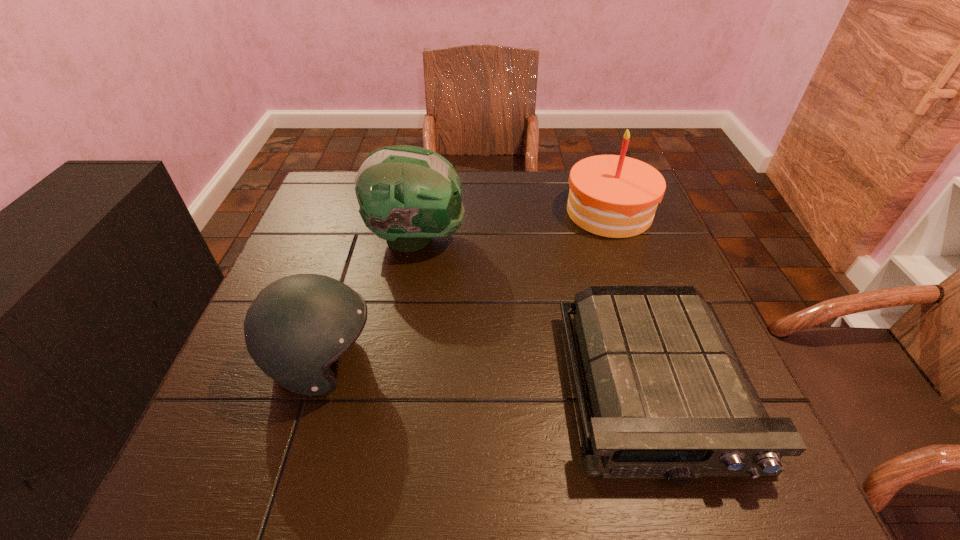
Where is `vacant space at the far left corner of the desktop`? Image resolution: width=960 pixels, height=540 pixels. vacant space at the far left corner of the desktop is located at coordinates (337, 200).

You are a GUI agent. You are given a task and a screenshot of the screen. Output one action in this format:
    pyautogui.click(x=<x>, y=<y>)
    Task: Click on the free point between the shorter football helmet and the shortest object
    Image resolution: width=960 pixels, height=540 pixels.
    Given the screenshot: What is the action you would take?
    pyautogui.click(x=489, y=376)

Find the location of `vacant point located between the taller football helmet and the nearer football helmet`. vacant point located between the taller football helmet and the nearer football helmet is located at coordinates (371, 301).

Locate an element on the screen. Image resolution: width=960 pixels, height=540 pixels. vacant point located between the nearer football helmet and the birthday cake is located at coordinates (467, 287).

Locate an element on the screen. The image size is (960, 540). free spot between the taller football helmet and the shortest object is located at coordinates (536, 314).

The image size is (960, 540). Find the location of `free space between the radio receiver and the farther football helmet`. free space between the radio receiver and the farther football helmet is located at coordinates (536, 314).

At what (x,y) coordinates should I click in order to perform the action: click on empty space that is in between the birthday cake and the shorter football helmet. Please return your answer as a coordinate pair (x, y). Looking at the image, I should click on (467, 287).

Locate an element on the screen. This screenshot has height=540, width=960. unoccupied area between the shorter football helmet and the taller football helmet is located at coordinates (371, 301).

The width and height of the screenshot is (960, 540). Identify the location of empty location between the shortest object and the farther football helmet. (536, 314).

This screenshot has width=960, height=540. I want to click on empty location between the farther football helmet and the radio receiver, so click(536, 314).